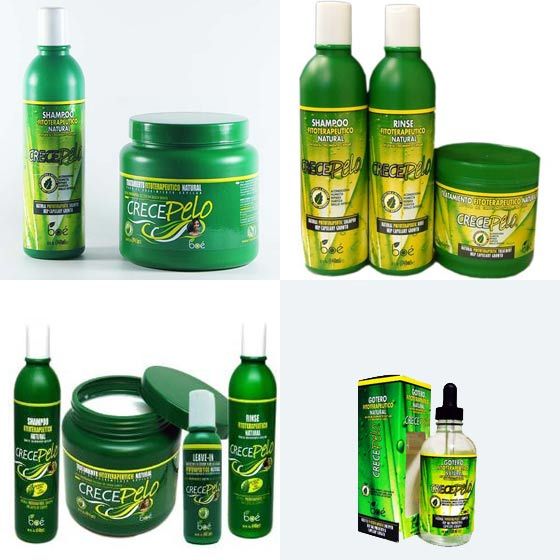
Locate an element on the screen. The image size is (560, 560). bottles is located at coordinates (316, 156), (408, 170), (249, 446), (207, 479), (50, 458).